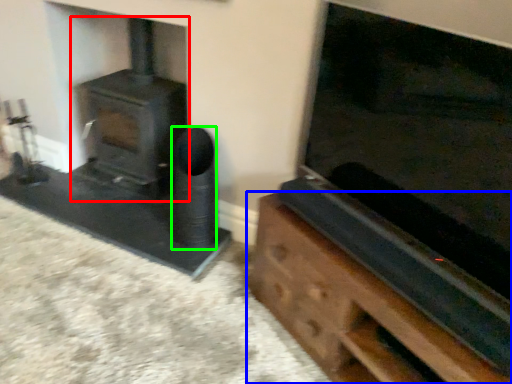
Question: Based on their relative distances, which object is nearer to wood burning stove (highlighted by a red box)? Choose from furniture (highlighted by a blue box) and speaker (highlighted by a green box).

Choices:
 (A) furniture
 (B) speaker

Answer: (B)